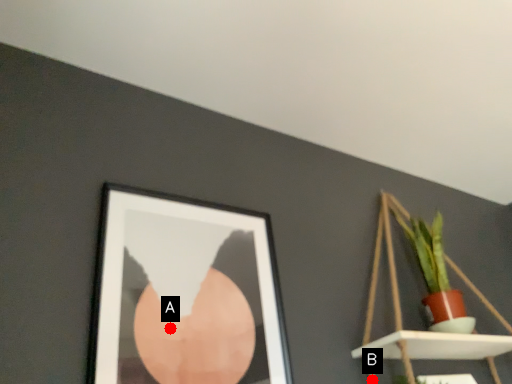
Question: Two points are circled on the image, labeled by A and B beside each circle. Which point appears closest to the camera in this image?

Choices:
 (A) A is closer
 (B) B is closer

Answer: (A)